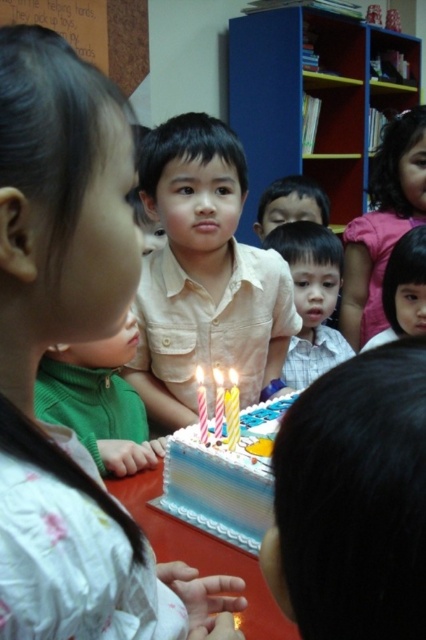
Question: Which point is closer to the camera taking this photo?

Choices:
 (A) (298, 205)
 (B) (112, 413)
 (C) (218, 408)

Answer: (C)

Question: Is matte yellow shirt at center above smooth skin face at center?

Choices:
 (A) yes
 (B) no

Answer: (B)

Question: Estimate the real-world distances between objects in this image. Which object is closer to the matte yellow shirt at center?

Choices:
 (A) green fleece sweater at lower left
 (B) striped fondant cake at center
 (C) matte beige shirt at center

Answer: (A)

Question: Can you confirm if smooth pink hair at lower right is bigger than smooth skin face at center?

Choices:
 (A) no
 (B) yes

Answer: (A)

Question: Among these points, which one is farthest from the camera?

Choices:
 (A) (106, 468)
 (B) (233, 410)

Answer: (A)

Question: In this image, where is matte beige shirt at center located relative to smooth pink hair at lower right?

Choices:
 (A) below
 (B) above

Answer: (A)